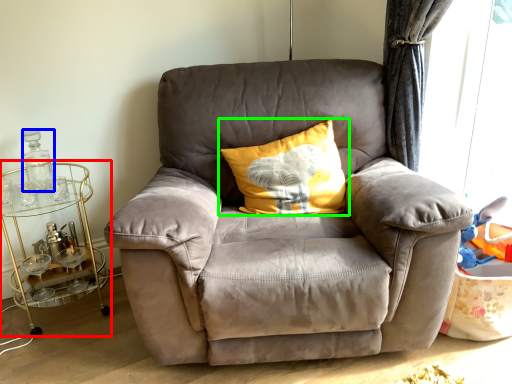
Question: Based on their relative distances, which object is nearer to table (highlighted by a red box)? Choose from bottle (highlighted by a blue box) and pillow (highlighted by a green box).

Choices:
 (A) bottle
 (B) pillow

Answer: (A)